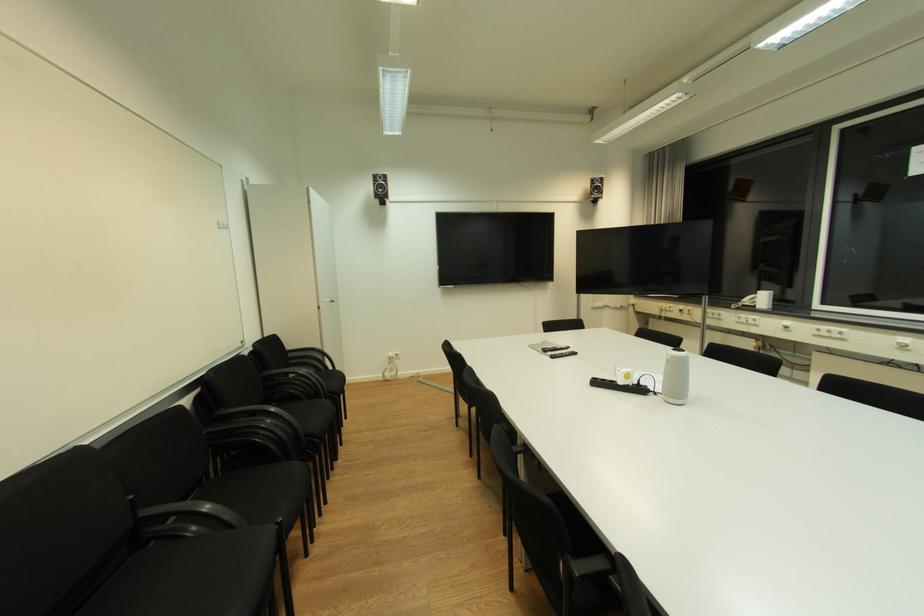
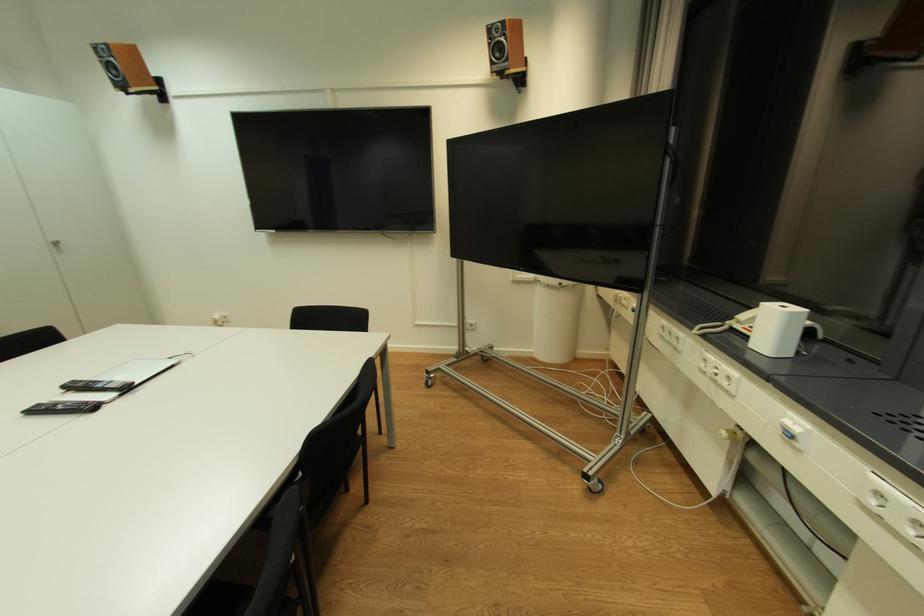
Locate, in the second image, the point that corresponds to point (613, 312) in the first image.

(544, 290)